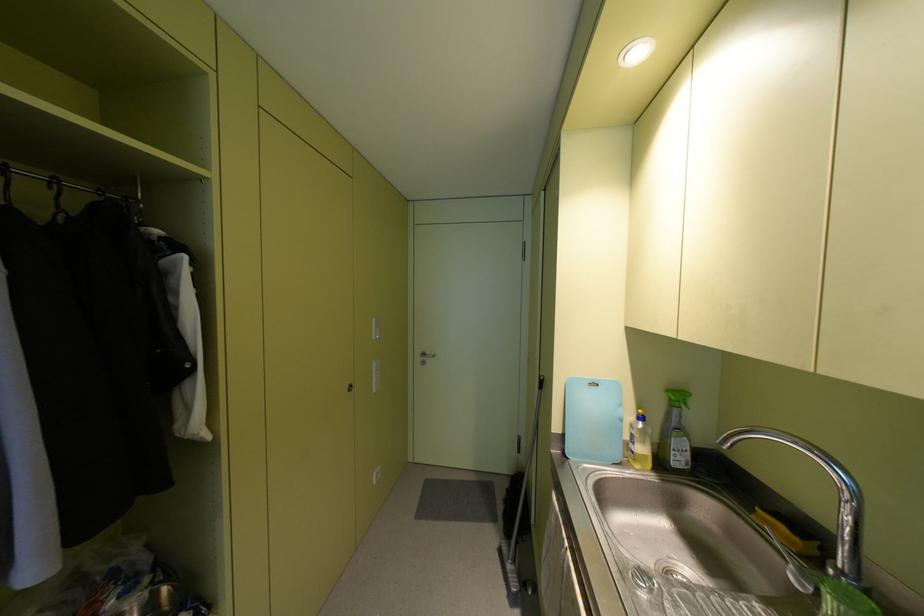
Image resolution: width=924 pixels, height=616 pixels. I want to click on cabinet lock, so click(346, 390).